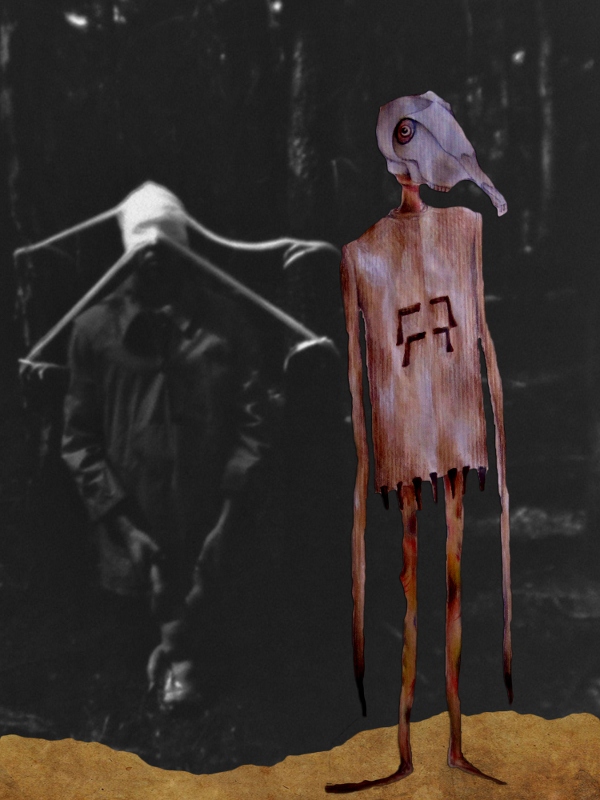
Find the location of `doll`. doll is located at coordinates (185, 638).